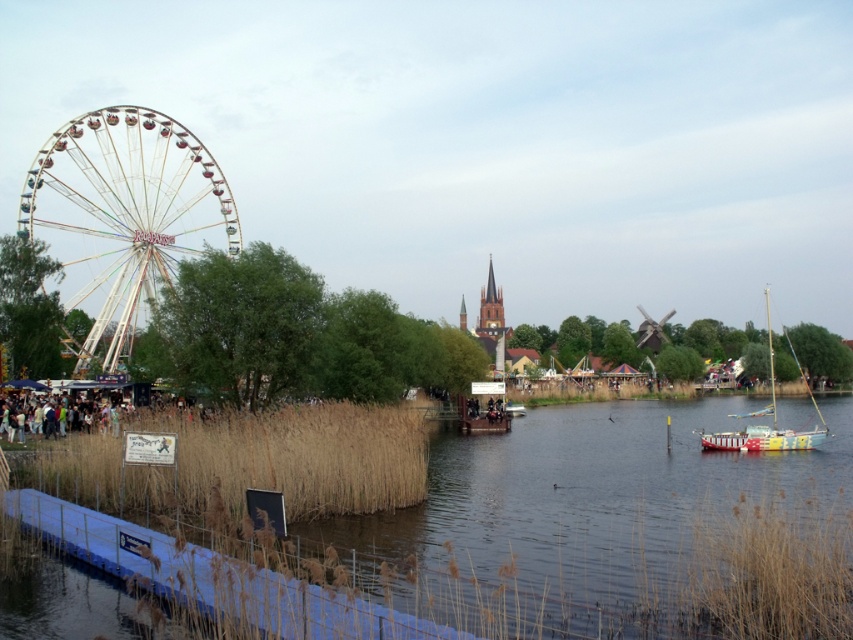
Does multicolored metallic ferris wheel at left have a smaller size compared to painted wood sailboat at right?

Yes, multicolored metallic ferris wheel at left is smaller than painted wood sailboat at right.

Is point (57, 259) less distant than point (717, 435)?

Yes, it is.

Which is behind, point (201, 180) or point (704, 436)?

Positioned behind is point (704, 436).

You are a GUI agent. You are given a task and a screenshot of the screen. Output one action in this format:
    pyautogui.click(x=<x>, y=<y>)
    Task: Click on the multicolored metallic ferris wheel at left
    
    Given the screenshot: What is the action you would take?
    pyautogui.click(x=123, y=216)